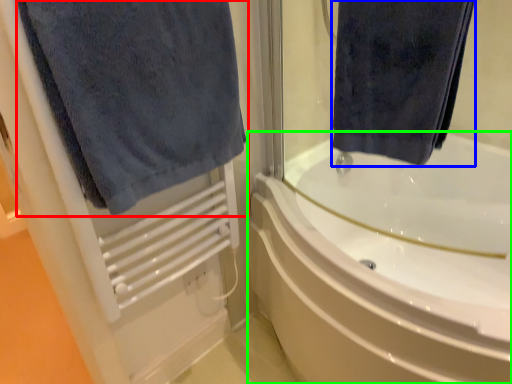
Question: Which object is positioned closest to towel (highlighted by a red box)? Select from towel (highlighted by a blue box) and bathtub (highlighted by a green box).

Choices:
 (A) towel
 (B) bathtub

Answer: (A)